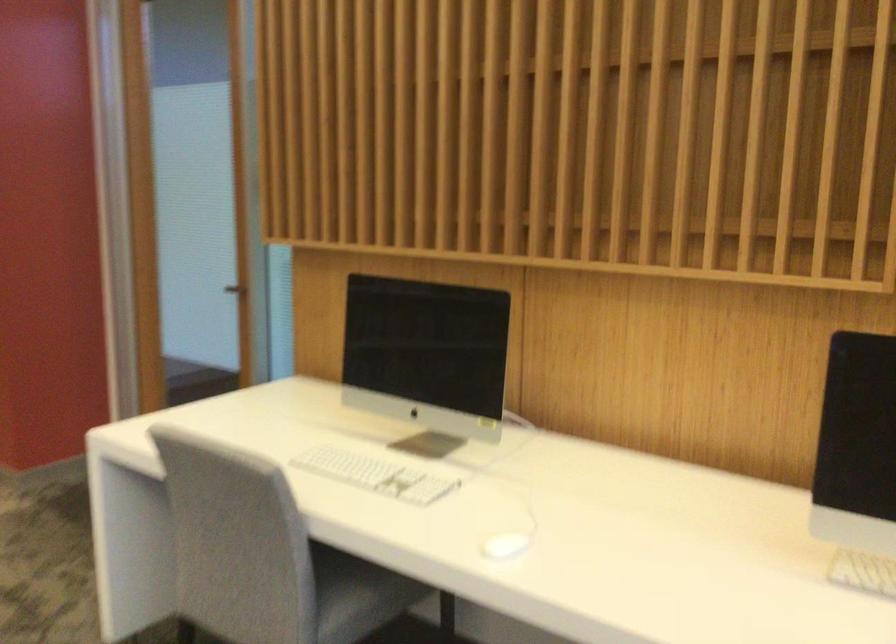
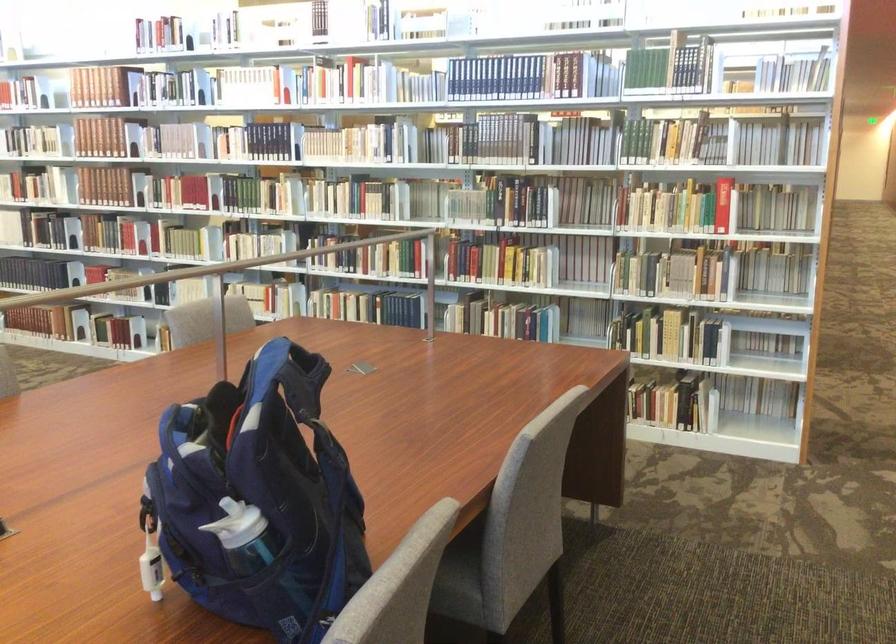
Question: The images are taken continuously from a first-person perspective. In which direction is your viewpoint rotating?

Choices:
 (A) Left
 (B) Right
 (C) Up
 (D) Down

Answer: (A)